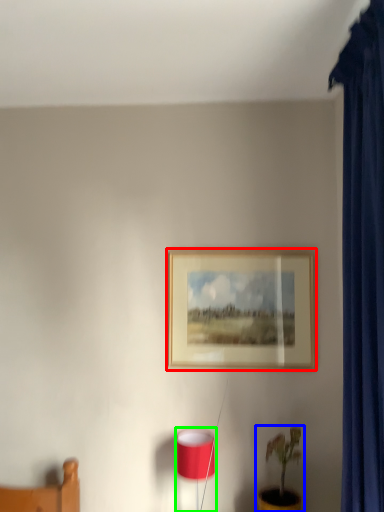
Question: Considering the real-world distances, which object is closest to picture frame (highlighted by a red box)? houseplant (highlighted by a blue box) or table lamp (highlighted by a green box).

Choices:
 (A) houseplant
 (B) table lamp

Answer: (B)